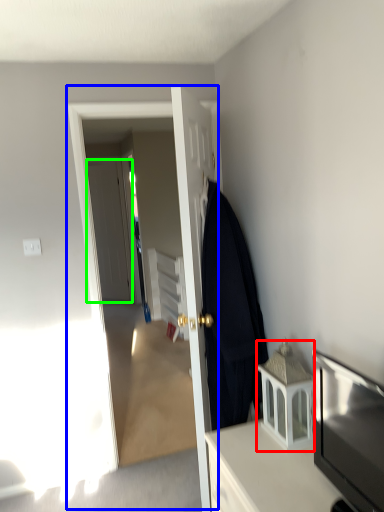
Question: Considering the real-world distances, which object is closest to cabinetry (highlighted by a red box)? screen door (highlighted by a blue box) or door (highlighted by a green box).

Choices:
 (A) screen door
 (B) door

Answer: (A)